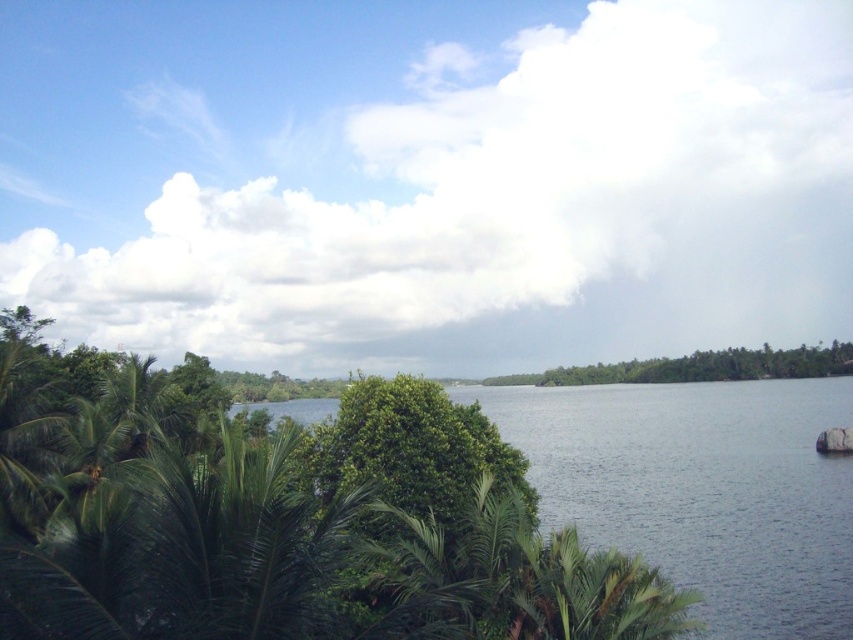
Which of these two, dark blue water at center or green leafy trees at center, stands taller?

dark blue water at center

Which is in front, point (729, 637) or point (563, 378)?

Point (729, 637)

Does point (746, 577) come in front of point (759, 376)?

Yes, point (746, 577) is closer to viewer.

Where is `dark blue water at center`? The height and width of the screenshot is (640, 853). dark blue water at center is located at coordinates (701, 490).

Is green leafy tree at center shorter than green leafy trees at center?

Indeed, green leafy tree at center has a lesser height compared to green leafy trees at center.

Is point (461, 429) behind point (757, 378)?

That is False.

Is point (347, 397) in front of point (654, 371)?

Yes, point (347, 397) is in front of point (654, 371).

Where is `green leafy tree at center`? green leafy tree at center is located at coordinates (409, 449).

Can you confirm if dark blue water at center is bigger than green leafy tree at center?

Yes, dark blue water at center is bigger than green leafy tree at center.

Is dark blue water at center above green leafy tree at center?

No, dark blue water at center is not above green leafy tree at center.

Which is behind, point (601, 474) or point (355, 428)?

Positioned behind is point (601, 474).

The width and height of the screenshot is (853, 640). Find the location of `dark blue water at center`. dark blue water at center is located at coordinates (701, 490).